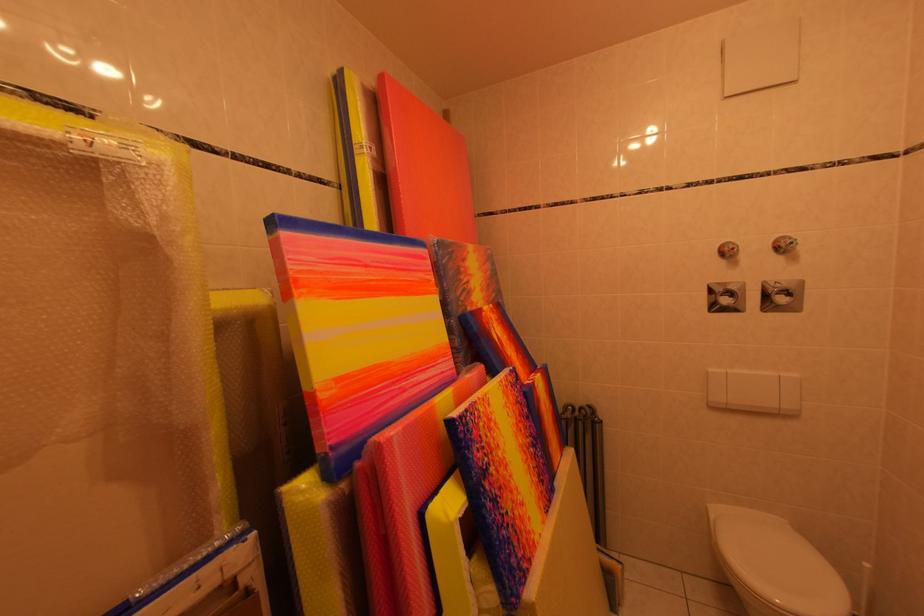
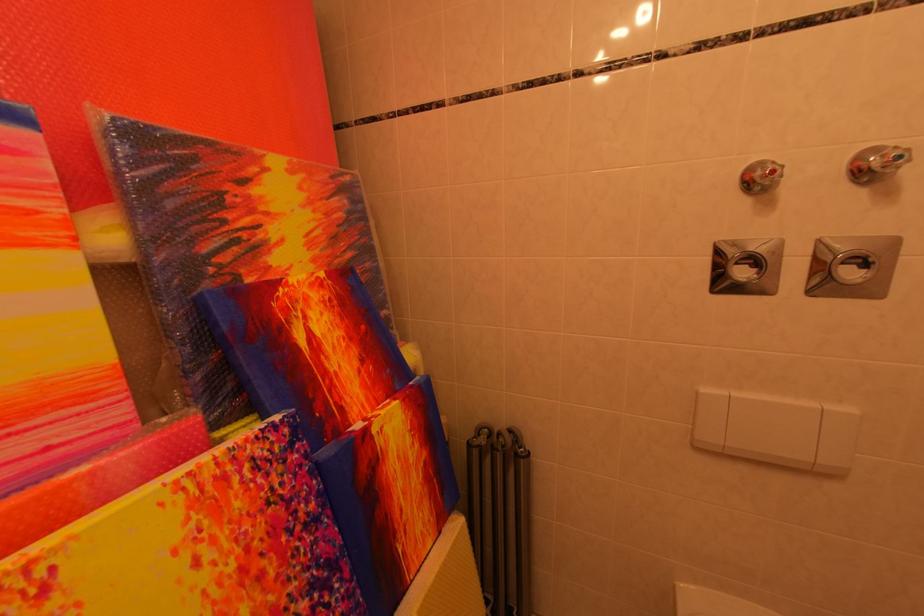
In the second image, find the point that corresponds to (531,434) in the first image.

(281, 575)